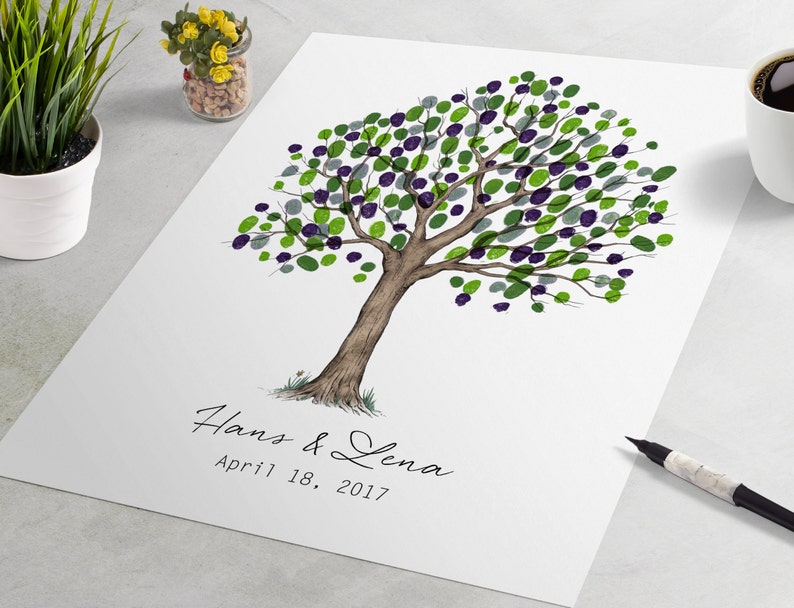
Image resolution: width=794 pixels, height=608 pixels. Find the location of `painting`. painting is located at coordinates (496, 340).